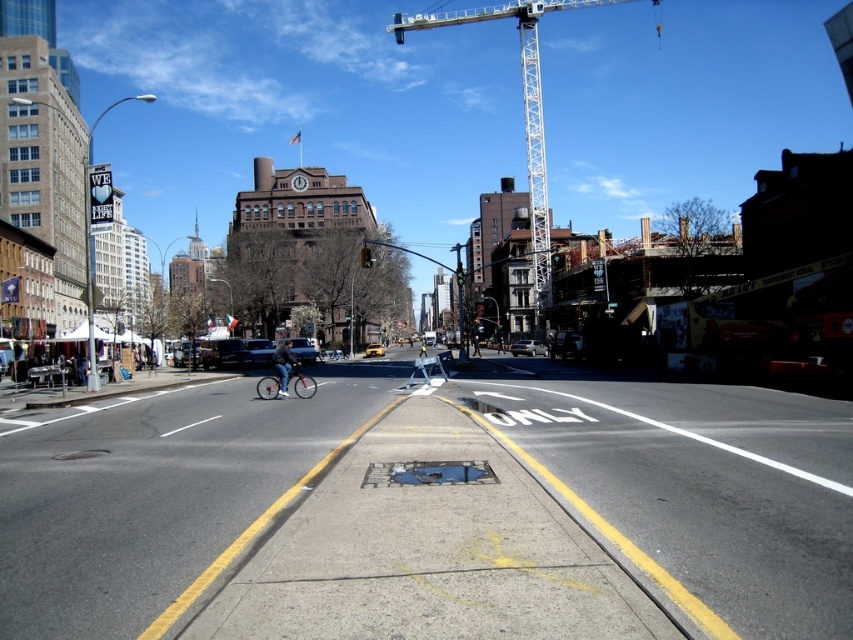
You are standing at the center of the road and want to locate the white metallic crane at upper center. Which direction should you look to find it?

You should look towards the upper center direction to locate the white metallic crane at upper center.

You are a delivery drone flying above the urban street scene. You need to land on the shiny silver bicycle at center. What are the coordinates where you should land?

The coordinates for the shiny silver bicycle at center are at point (300, 381).

From the picture: You are a city planner assessing the safety of the urban street scene. Given the distance between the white metallic crane at upper center and the silver metallic sedan at center, would a 160 meter safety zone between construction equipment and parked vehicles be sufficient to comply with safety regulations?

The white metallic crane at upper center and silver metallic sedan at center are 158.17 meters apart. Since the required safety zone is 160 meters, the current distance is insufficient to comply with safety regulations.